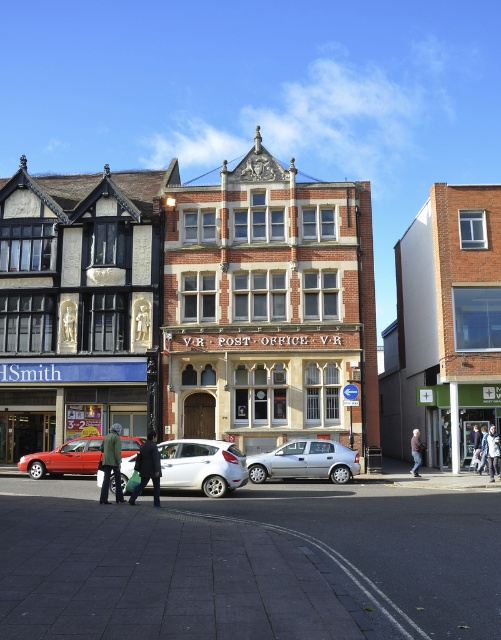
Who is taller, silver metallic car at center or dark blue jeans at center?

Standing taller between the two is dark blue jeans at center.

Does point (305, 451) lie behind point (471, 440)?

No, (305, 451) is in front of (471, 440).

At what (x,y) coordinates should I click in order to perform the action: click on silver metallic car at center. Please return your answer as a coordinate pair (x, y). The width and height of the screenshot is (501, 640). Looking at the image, I should click on (306, 461).

Is point (65, 461) positioned behind point (475, 468)?

No, it is not.

Is matte red car at center smaller than dark blue jeans at center?

Correct, matte red car at center occupies less space than dark blue jeans at center.

Between point (137, 449) and point (476, 458), which one is positioned behind?

The point (476, 458) is more distant.

The height and width of the screenshot is (640, 501). I want to click on matte red car at center, so click(65, 458).

Does point (51, 467) lie behind point (116, 467)?

Yes.

Is point (80, 468) positioned in front of point (119, 477)?

No, it is not.

Find the location of a particular element. This screenshot has height=640, width=501. matte red car at center is located at coordinates (65, 458).